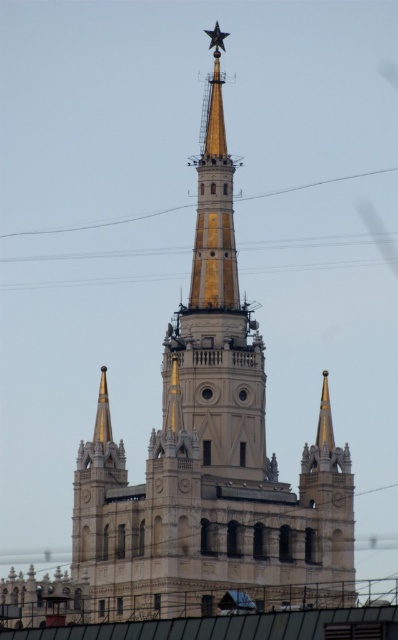
Question: Which of the following is the closest to the observer?

Choices:
 (A) yellow metallic power line at upper center
 (B) metallic gold star at upper center
 (C) gold polished metal spire at center

Answer: (C)

Question: Does yellow metallic power line at upper center have a smaller size compared to metallic gold star at upper center?

Choices:
 (A) yes
 (B) no

Answer: (B)

Question: Can you confirm if gold polished metal spire at center is positioned above yellow metallic power line at upper center?

Choices:
 (A) no
 (B) yes

Answer: (A)

Question: Can you confirm if gold polished metal spire at center is wider than yellow metallic power line at upper center?

Choices:
 (A) no
 (B) yes

Answer: (A)

Question: Considering the real-world distances, which object is farthest from the gold polished metal spire at center?

Choices:
 (A) metallic gold star at upper center
 (B) yellow metallic power line at upper center

Answer: (B)

Question: Which of the following is the closest to the observer?

Choices:
 (A) (210, 40)
 (B) (200, 234)
 (C) (42, 230)

Answer: (B)